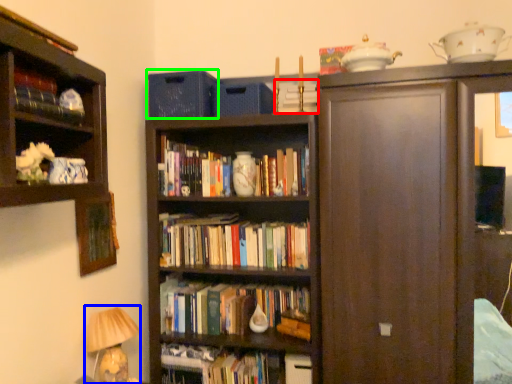
Question: Which object is positioned closest to book (highlighted by a red box)? Select from table lamp (highlighted by a blue box) and cabinetry (highlighted by a green box).

Choices:
 (A) table lamp
 (B) cabinetry

Answer: (B)